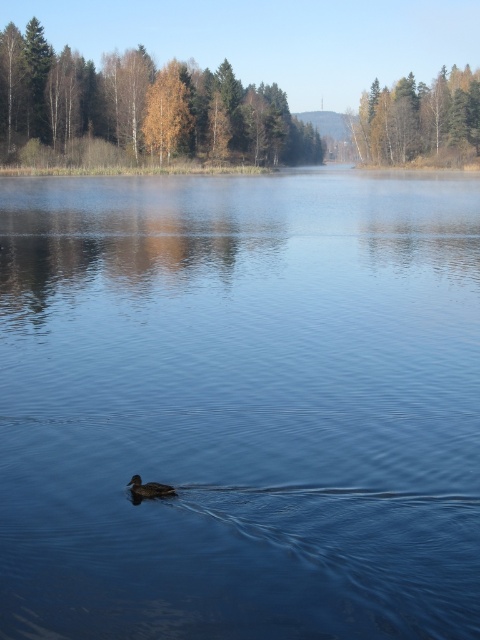
You are standing at the edge of the lake and see the transparent blue water at center and the brown matte duck at center. Which object is closer to you?

The transparent blue water at center is closer to the viewer than the brown matte duck at center.